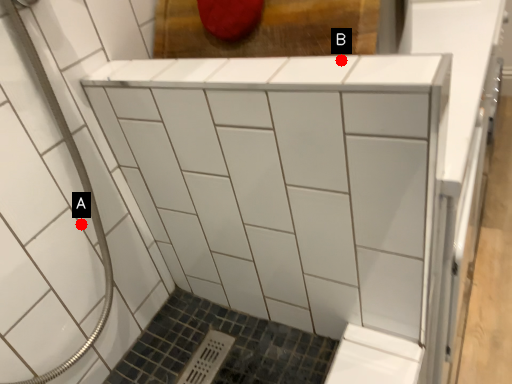
Question: Two points are circled on the image, labeled by A and B beside each circle. Which point appears closest to the camera in this image?

Choices:
 (A) A is closer
 (B) B is closer

Answer: (B)